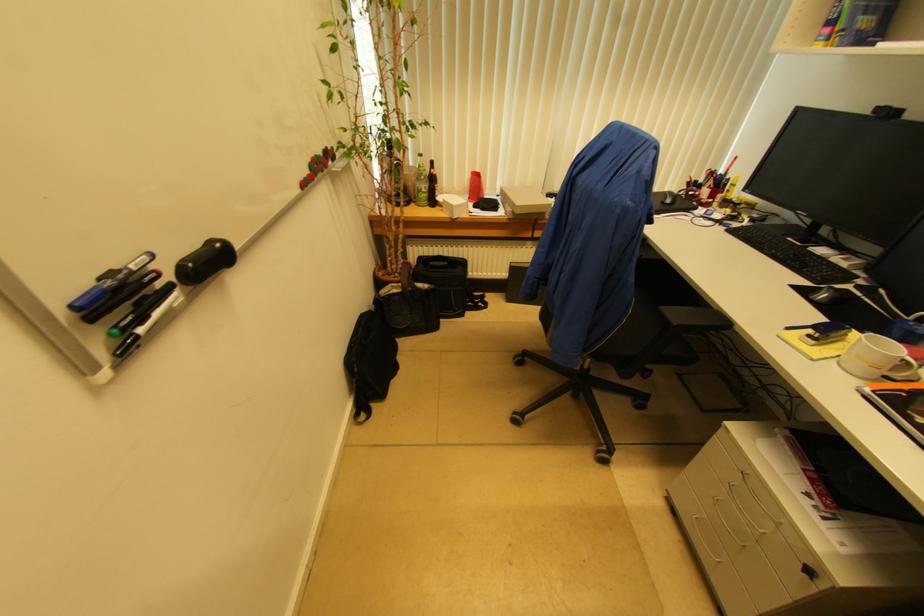
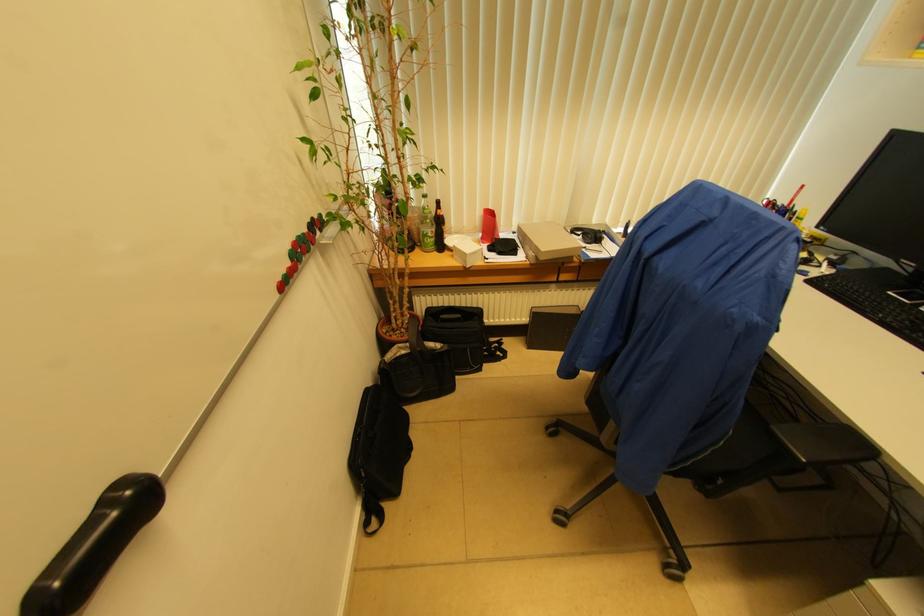
The point at (x=396, y=371) is marked in the first image. Where is the corresponding point in the second image?

(409, 451)